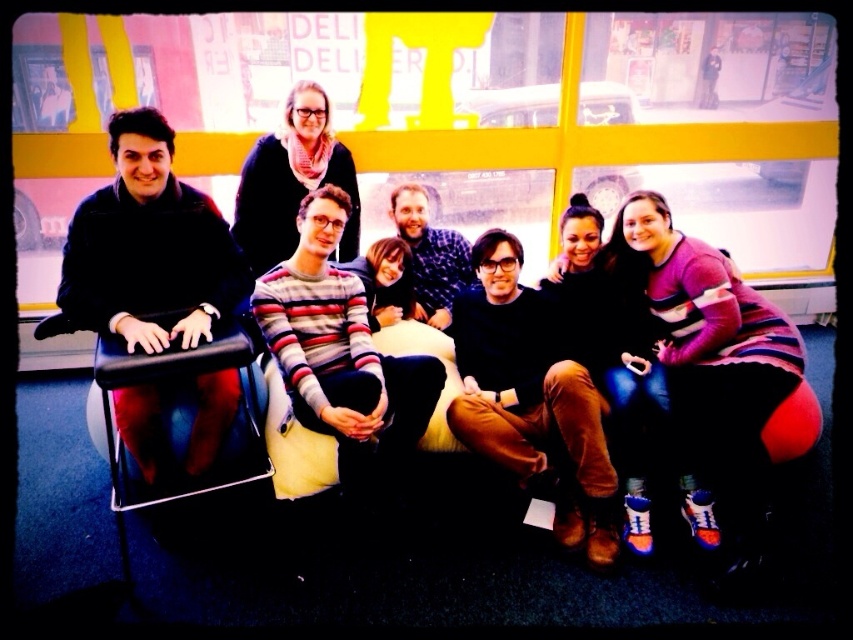
You are a photographer taking a group photo of the seven people in the public transportation setting. You want to ensure that the black leather chair at left and the matte black sweater at upper center are both visible in the frame. Given their sizes, which object should you focus on to ensure both are clearly captured?

The black leather chair at left is larger in size compared to the matte black sweater at upper center, so focusing on the black leather chair at left will help ensure both objects are clearly visible in the frame.

You are a photographer trying to capture a candid shot of the black leather chair at left. Since you can only focus on objects within a 0.5 unit radius from the center point, will the black leather chair at left be in focus if you center your camera at point [183,419]?

The point [183,419] marks the black leather chair at left, so centering the camera there would place it within the 0.5 unit radius, ensuring the black leather chair at left is in focus.

You are a photographer trying to capture a candid shot of the group. You notice the black leather chair at left and the matte black sweater at upper center. How far apart are these two items in the scene?

The black leather chair at left and the matte black sweater at upper center are 37.59 inches apart.